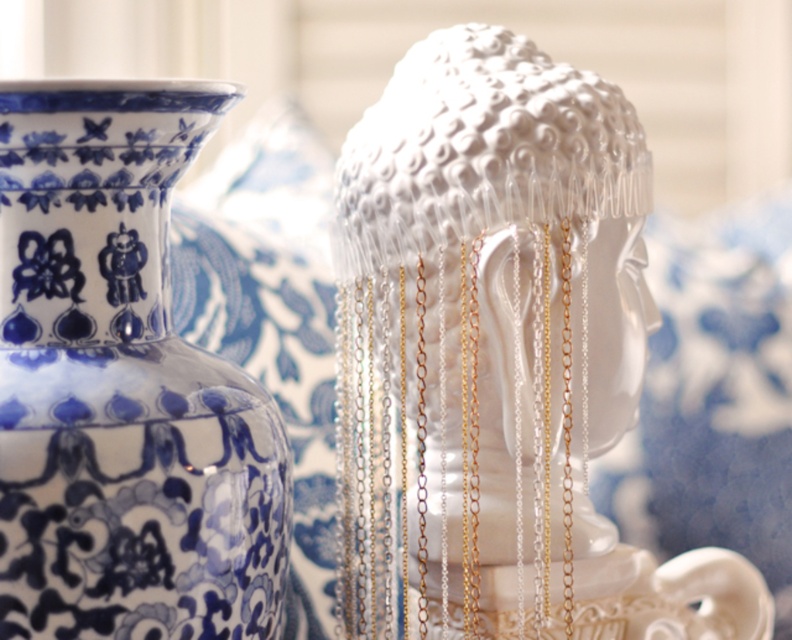
Is the position of white glossy headpiece at center more distant than that of blue porcelain vase at upper left?

Yes.

Which is in front, point (589, 554) or point (166, 493)?

Point (166, 493) is more forward.

Identify the location of white glossy headpiece at center. (501, 356).

Locate an element on the screen. white glossy headpiece at center is located at coordinates coord(501,356).